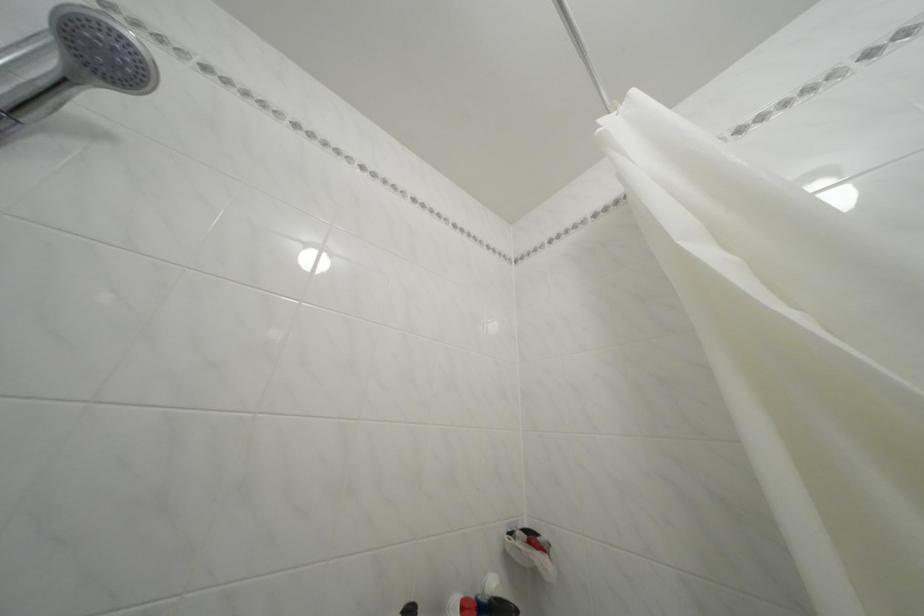
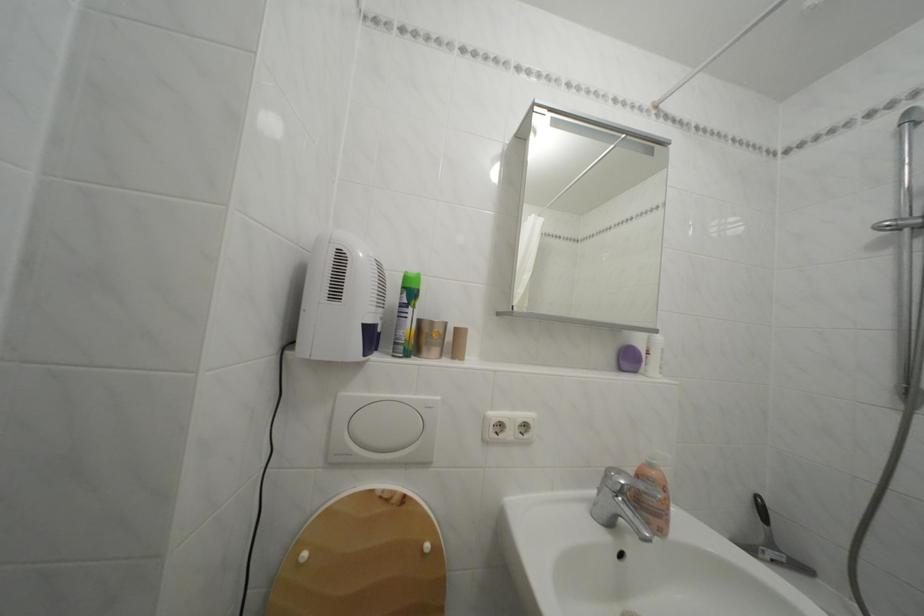
Based on the photo, the first image is from the beginning of the video and the second image is from the end. How did the camera likely rotate when shooting the video?

The camera's rotation is toward left-up.